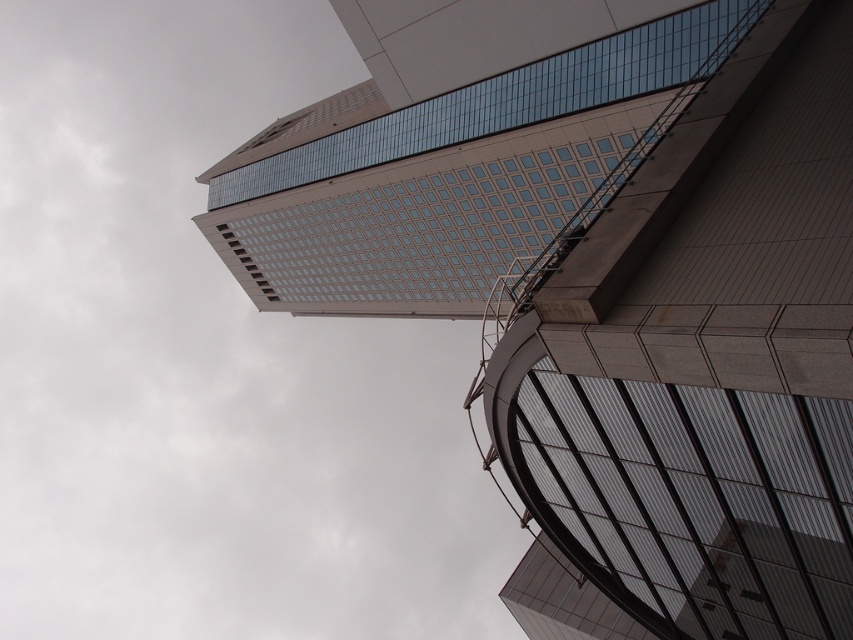
Is smooth glass building at upper center shorter than glassy reflective tower at upper center?

Yes.

Is point (547, 285) less distant than point (477, 285)?

Yes, it is.

Which is in front, point (744, 552) or point (355, 266)?

Point (744, 552) is in front.

Find the location of a particular element. The height and width of the screenshot is (640, 853). smooth glass building at upper center is located at coordinates (699, 368).